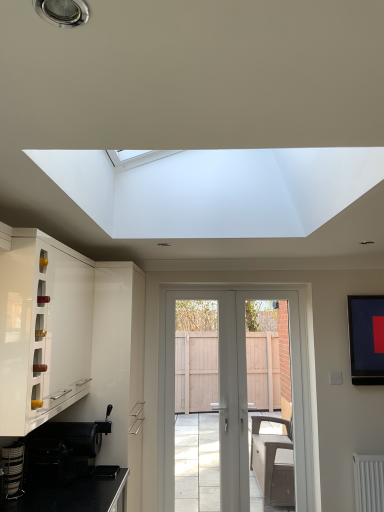
In order to click on white plastic screen door at center in this screenshot , I will do `click(293, 378)`.

What do you see at coordinates (13, 470) in the screenshot? I see `metallic silver coffee machine at lower left` at bounding box center [13, 470].

The height and width of the screenshot is (512, 384). I want to click on white plastic screen door at center, so click(x=293, y=378).

Can you confirm if white plastic screen door at center is positioned to the right of white glossy cabinet at left?

Yes, white plastic screen door at center is to the right of white glossy cabinet at left.

Looking at this image, is white plastic screen door at center next to white glossy cabinet at left and touching it?

No, white plastic screen door at center is not beside white glossy cabinet at left.

From the image's perspective, who appears lower, white plastic screen door at center or white glossy cabinet at left?

white plastic screen door at center appears lower in the image.

Between metallic silver coffee machine at lower left and white plastic screen door at center, which one has less height?

metallic silver coffee machine at lower left is shorter.

Is metallic silver coffee machine at lower left beside white plastic screen door at center?

No, metallic silver coffee machine at lower left is not with white plastic screen door at center.

Considering the relative sizes of metallic silver coffee machine at lower left and white plastic screen door at center in the image provided, is metallic silver coffee machine at lower left wider than white plastic screen door at center?

In fact, metallic silver coffee machine at lower left might be narrower than white plastic screen door at center.

Is metallic silver coffee machine at lower left at the right side of white plastic screen door at center?

No.

From the image's perspective, between metallic silver coffee machine at lower left and white glossy door at center, which one is located above?

metallic silver coffee machine at lower left, from the image's perspective.

From a real-world perspective, is metallic silver coffee machine at lower left above or below white glossy door at center?

In terms of real-world spatial position, metallic silver coffee machine at lower left is below white glossy door at center.

Consider the image. Is metallic silver coffee machine at lower left in front of or behind white glossy door at center in the image?

metallic silver coffee machine at lower left is positioned closer to the viewer than white glossy door at center.

This screenshot has height=512, width=384. In order to click on appliance on the left of white glossy door at center in this screenshot , I will do `click(13, 470)`.

Which is in front, point (18, 376) or point (240, 352)?

Point (18, 376)

Is white plastic screen door at center a part of white glossy cabinet at left?

No, white plastic screen door at center is not surrounded by white glossy cabinet at left.

Does white plastic screen door at center lie in front of white glossy door at center?

Yes, white plastic screen door at center is in front of white glossy door at center.

How many degrees apart are the facing directions of white plastic screen door at center and white glossy door at center?

0.2 degrees separate the facing orientations of white plastic screen door at center and white glossy door at center.

You are a GUI agent. You are given a task and a screenshot of the screen. Output one action in this format:
    pyautogui.click(x=<x>, y=<y>)
    Task: Click on the screen door on the right of the white glossy door at center
    
    Given the screenshot: What is the action you would take?
    pyautogui.click(x=293, y=378)

In the scene shown: Which object is thinner, white plastic screen door at center or white glossy door at center?

Thinner between the two is white glossy door at center.

In terms of height, does white glossy cabinet at left look taller or shorter compared to metallic silver coffee machine at lower left?

Clearly, white glossy cabinet at left is taller compared to metallic silver coffee machine at lower left.

From a real-world perspective, which object stands above the other?

white glossy cabinet at left is physically above.

Measure the distance from white glossy cabinet at left to metallic silver coffee machine at lower left.

The distance of white glossy cabinet at left from metallic silver coffee machine at lower left is 21.24 inches.

Is white glossy cabinet at left placed right next to metallic silver coffee machine at lower left?

No.

Considering the relative positions of white glossy door at center and white glossy cabinet at left in the image provided, is white glossy door at center to the right of white glossy cabinet at left from the viewer's perspective?

Correct, you'll find white glossy door at center to the right of white glossy cabinet at left.

In terms of width, does white glossy door at center look wider or thinner when compared to white glossy cabinet at left?

Clearly, white glossy door at center has less width compared to white glossy cabinet at left.

Considering the sizes of objects white glossy door at center and white glossy cabinet at left in the image provided, who is taller, white glossy door at center or white glossy cabinet at left?

white glossy door at center.

What's the angular difference between white glossy door at center and white glossy cabinet at left's facing directions?

The angle between the facing direction of white glossy door at center and the facing direction of white glossy cabinet at left is 89.6 degrees.

At what (x,y) coordinates should I click in order to perform the action: click on cabinetry in front of the white plastic screen door at center. Please return your answer as a coordinate pair (x, y). Looking at the image, I should click on (42, 328).

You are a GUI agent. You are given a task and a screenshot of the screen. Output one action in this format:
    pyautogui.click(x=<x>, y=<y>)
    Task: Click on the screen door lying behind the metallic silver coffee machine at lower left
    Image resolution: width=384 pixels, height=512 pixels.
    Given the screenshot: What is the action you would take?
    pyautogui.click(x=293, y=378)

From the picture: Which object lies further to the anchor point metallic silver coffee machine at lower left, white plastic screen door at center or white glossy cabinet at left?

Among the two, white plastic screen door at center is located further to metallic silver coffee machine at lower left.

Estimate the real-world distances between objects in this image. Which object is further from white glossy door at center, metallic silver coffee machine at lower left or white glossy cabinet at left?

Based on the image, metallic silver coffee machine at lower left appears to be further to white glossy door at center.

Considering their positions, is metallic silver coffee machine at lower left positioned further to white glossy cabinet at left than white plastic screen door at center?

white plastic screen door at center is further to white glossy cabinet at left.

Estimate the real-world distances between objects in this image. Which object is further from white plastic screen door at center, white glossy cabinet at left or metallic silver coffee machine at lower left?

metallic silver coffee machine at lower left lies further to white plastic screen door at center than the other object.

Which object lies further to the anchor point white glossy door at center, white glossy cabinet at left or metallic silver coffee machine at lower left?

metallic silver coffee machine at lower left is positioned further to the anchor white glossy door at center.

Based on their spatial positions, is white plastic screen door at center or white glossy door at center closer to metallic silver coffee machine at lower left?

The object closer to metallic silver coffee machine at lower left is white glossy door at center.

Considering their positions, is white glossy cabinet at left positioned further to metallic silver coffee machine at lower left than white plastic screen door at center?

white plastic screen door at center.

Considering their positions, is white glossy door at center positioned closer to metallic silver coffee machine at lower left than white glossy cabinet at left?

white glossy cabinet at left is positioned closer to the anchor metallic silver coffee machine at lower left.

The height and width of the screenshot is (512, 384). What are the coordinates of `appliance between white glossy cabinet at left and white glossy door at center in the front-back direction` in the screenshot? It's located at (13, 470).

Locate an element on the screen. The height and width of the screenshot is (512, 384). screen door between white glossy cabinet at left and white glossy door at center from front to back is located at coordinates [293, 378].

Identify the location of door located between metallic silver coffee machine at lower left and white plastic screen door at center in the left-right direction. (230, 395).

The height and width of the screenshot is (512, 384). What are the coordinates of `cabinetry located between metallic silver coffee machine at lower left and white plastic screen door at center in the left-right direction` in the screenshot? It's located at (42, 328).